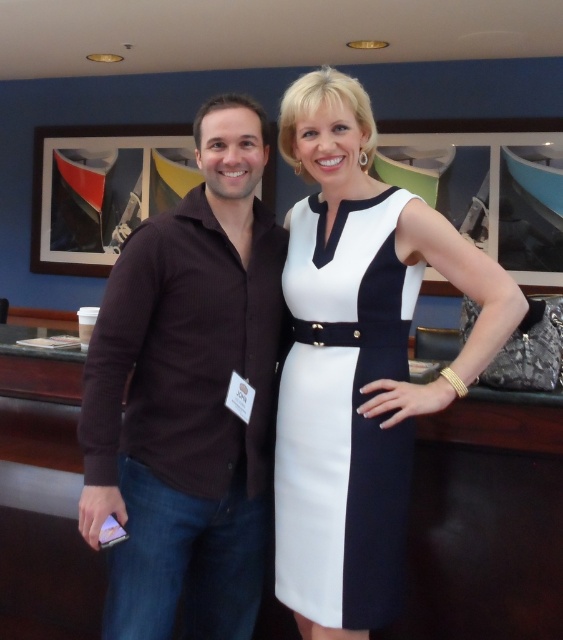
Does white leather dress at center have a greater width compared to white smooth dress at center?

Indeed, white leather dress at center has a greater width compared to white smooth dress at center.

Consider the image. Can you confirm if white leather dress at center is bigger than white smooth dress at center?

Indeed, white leather dress at center has a larger size compared to white smooth dress at center.

Identify the location of white leather dress at center. Image resolution: width=563 pixels, height=640 pixels. (359, 360).

Can you confirm if brown ribbed sweater at center is thinner than white smooth dress at center?

No, brown ribbed sweater at center is not thinner than white smooth dress at center.

Who is lower down, brown ribbed sweater at center or white smooth dress at center?

white smooth dress at center is below.

Between point (251, 128) and point (300, 602), which one is positioned behind?

Positioned behind is point (300, 602).

The height and width of the screenshot is (640, 563). I want to click on brown ribbed sweater at center, so click(189, 396).

Between brown ribbed sweater at center and white leather dress at center, which one appears on the left side from the viewer's perspective?

From the viewer's perspective, brown ribbed sweater at center appears more on the left side.

Does point (149, 440) come farther from viewer compared to point (348, 282)?

Yes, it is behind point (348, 282).

You are a GUI agent. You are given a task and a screenshot of the screen. Output one action in this format:
    pyautogui.click(x=<x>, y=<y>)
    Task: Click on the brown ribbed sweater at center
    
    Given the screenshot: What is the action you would take?
    pyautogui.click(x=189, y=396)

At what (x,y) coordinates should I click in order to perform the action: click on brown ribbed sweater at center. Please return your answer as a coordinate pair (x, y). Looking at the image, I should click on (189, 396).